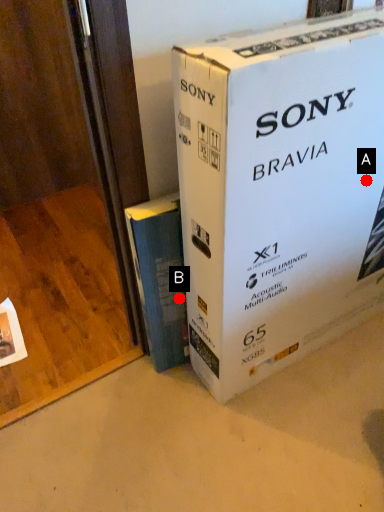
Question: Two points are circled on the image, labeled by A and B beside each circle. Which of the following is the farthest from the observer?

Choices:
 (A) A is further
 (B) B is further

Answer: (B)